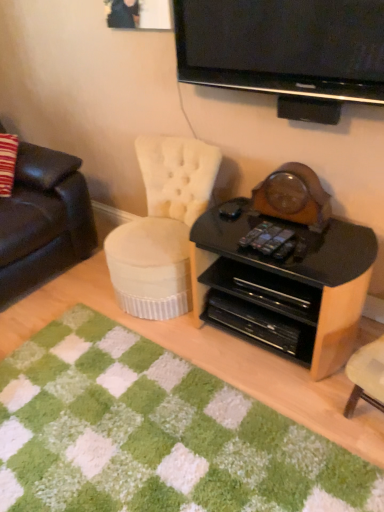
Question: Does black plastic remote control at center contain green shaggy rug at lower center?

Choices:
 (A) no
 (B) yes

Answer: (A)

Question: From the image's perspective, is black plastic remote control at center over green shaggy rug at lower center?

Choices:
 (A) yes
 (B) no

Answer: (A)

Question: Can you confirm if black plastic remote control at center is thinner than green shaggy rug at lower center?

Choices:
 (A) yes
 (B) no

Answer: (A)

Question: Considering the relative positions of black plastic remote control at center and green shaggy rug at lower center in the image provided, is black plastic remote control at center to the left of green shaggy rug at lower center from the viewer's perspective?

Choices:
 (A) yes
 (B) no

Answer: (B)

Question: Is black plastic remote control at center aimed at green shaggy rug at lower center?

Choices:
 (A) yes
 (B) no

Answer: (B)

Question: Is point (213, 173) positioned closer to the camera than point (273, 243)?

Choices:
 (A) closer
 (B) farther

Answer: (B)

Question: Do you think white tufted fabric chair at center is within black plastic remote control at center, or outside of it?

Choices:
 (A) inside
 (B) outside

Answer: (B)

Question: From a real-world perspective, is white tufted fabric chair at center positioned above or below black plastic remote control at center?

Choices:
 (A) above
 (B) below

Answer: (B)

Question: Would you say white tufted fabric chair at center is to the left or to the right of black plastic remote control at center in the picture?

Choices:
 (A) left
 (B) right

Answer: (A)

Question: Relative to black plastic remote control at center, is black plastic drawer at center in front or behind?

Choices:
 (A) behind
 (B) front

Answer: (A)

Question: In terms of size, does black plastic drawer at center appear bigger or smaller than black plastic remote control at center?

Choices:
 (A) big
 (B) small

Answer: (A)

Question: Considering the positions of point (251, 301) and point (271, 232), is point (251, 301) closer or farther from the camera than point (271, 232)?

Choices:
 (A) farther
 (B) closer

Answer: (A)

Question: In terms of width, does black plastic drawer at center look wider or thinner when compared to black plastic remote control at center?

Choices:
 (A) thin
 (B) wide

Answer: (B)

Question: From a real-world perspective, relative to black glossy television at upper center, is white tufted fabric chair at center vertically above or below?

Choices:
 (A) below
 (B) above

Answer: (A)

Question: From the image's perspective, is white tufted fabric chair at center positioned above or below black glossy television at upper center?

Choices:
 (A) below
 (B) above

Answer: (A)